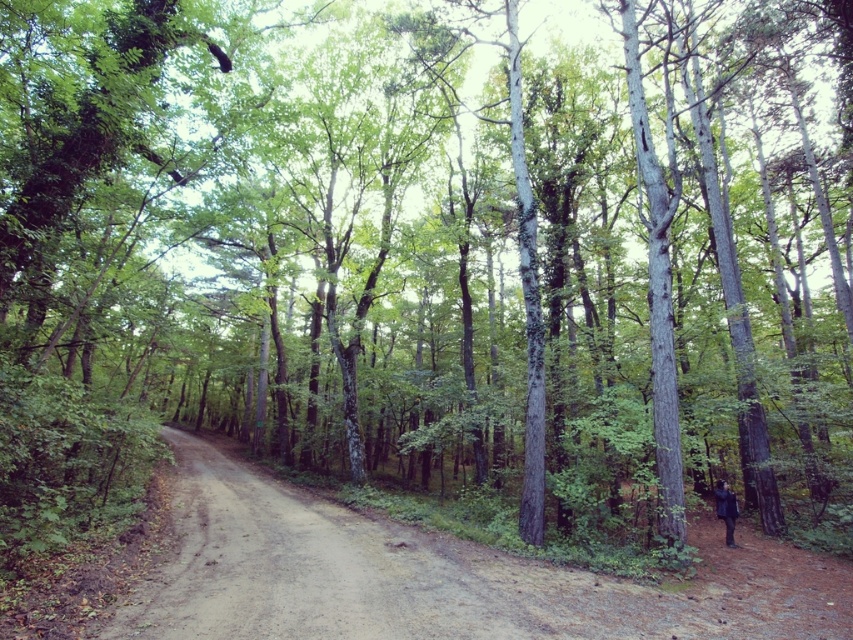
Question: Is brown dirt track at center thinner than dark matte jacket at lower right?

Choices:
 (A) yes
 (B) no

Answer: (B)

Question: Which point is closer to the camera?

Choices:
 (A) dark matte jacket at lower right
 (B) brown dirt track at center

Answer: (B)

Question: Is brown dirt track at center to the left of dark matte jacket at lower right from the viewer's perspective?

Choices:
 (A) no
 (B) yes

Answer: (B)

Question: Is brown dirt track at center closer to camera compared to dark matte jacket at lower right?

Choices:
 (A) yes
 (B) no

Answer: (A)